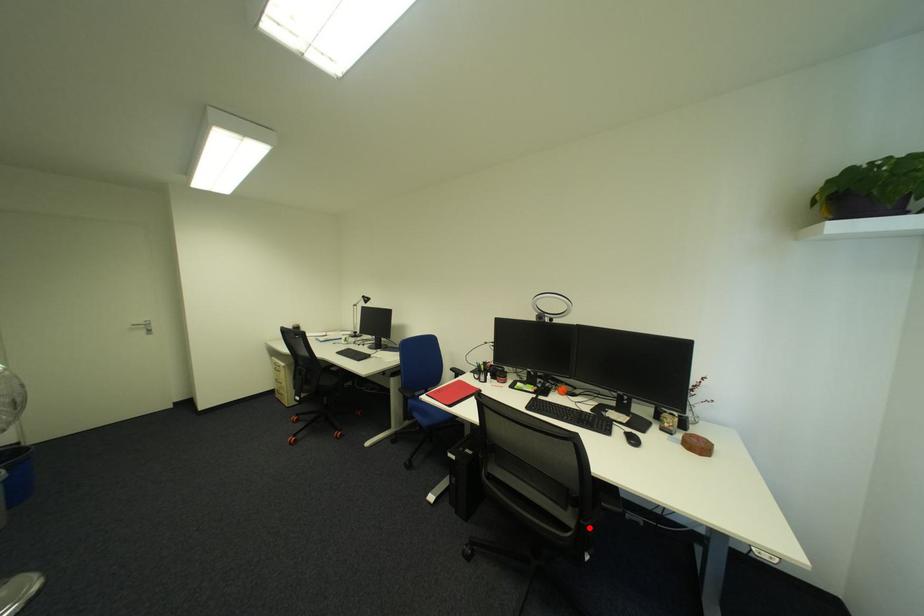
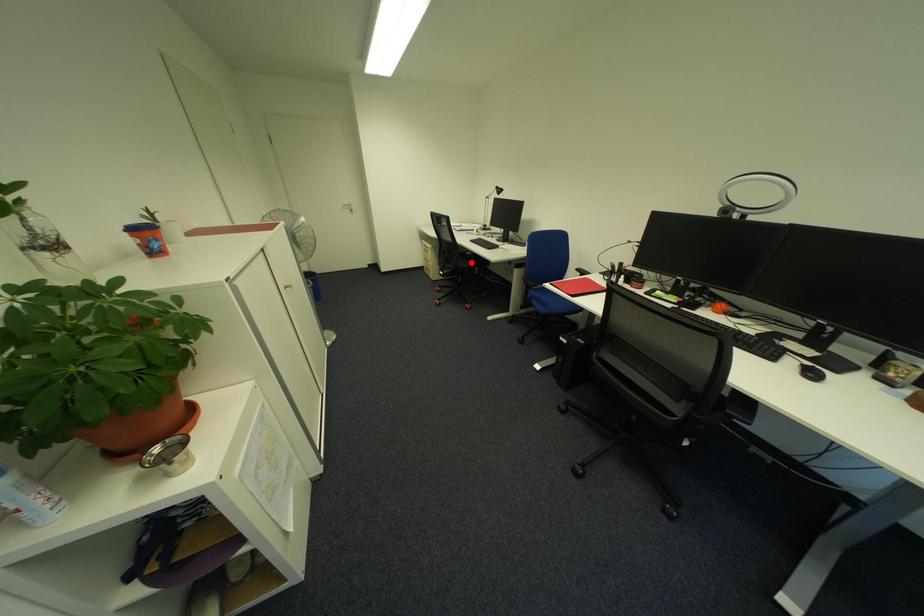
I am providing you with two images of the same scene from different viewpoints. A red point is marked on the first image and another point is marked on the second image. Does the point marked in image1 correspond to the same location as the one in image2?

No